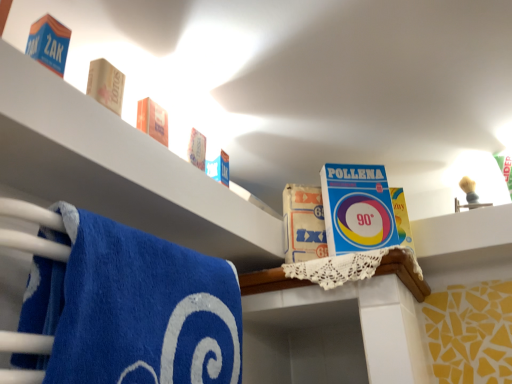
Question: Considering the positions of blue cardboard box at upper center, the 3th product in the front-to-back sequence, and blue cardboard box at upper left, the 3th product from the bottom, in the image, is blue cardboard box at upper center, the 3th product in the front-to-back sequence, wider or thinner than blue cardboard box at upper left, the 3th product from the bottom,?

Choices:
 (A) thin
 (B) wide

Answer: (B)

Question: From their relative heights in the image, would you say blue cardboard box at upper center, the 3th product in the front-to-back sequence, is taller or shorter than blue cardboard box at upper left, placed as the third product when sorted from right to left?

Choices:
 (A) tall
 (B) short

Answer: (A)

Question: Estimate the real-world distances between objects in this image. Which object is farther from the blue cardboard box at upper left, marked as the first product in a top-to-bottom arrangement?

Choices:
 (A) blue terry cloth towel at lower left
 (B) blue cardboard box at upper left
 (C) blue cardboard box at upper center, the 1th product in the back-to-front sequence
 (D) wooden block at upper left, which ranks as the second product in right-to-left order

Answer: (C)

Question: Which is nearer to the blue cardboard box at upper left?

Choices:
 (A) blue terry cloth towel at lower left
 (B) blue cardboard box at upper left, the 3th product from the bottom
 (C) blue cardboard box at upper center, the third product positioned from the left
 (D) wooden block at upper left, which appears as the 2th product when viewed from the top

Answer: (A)